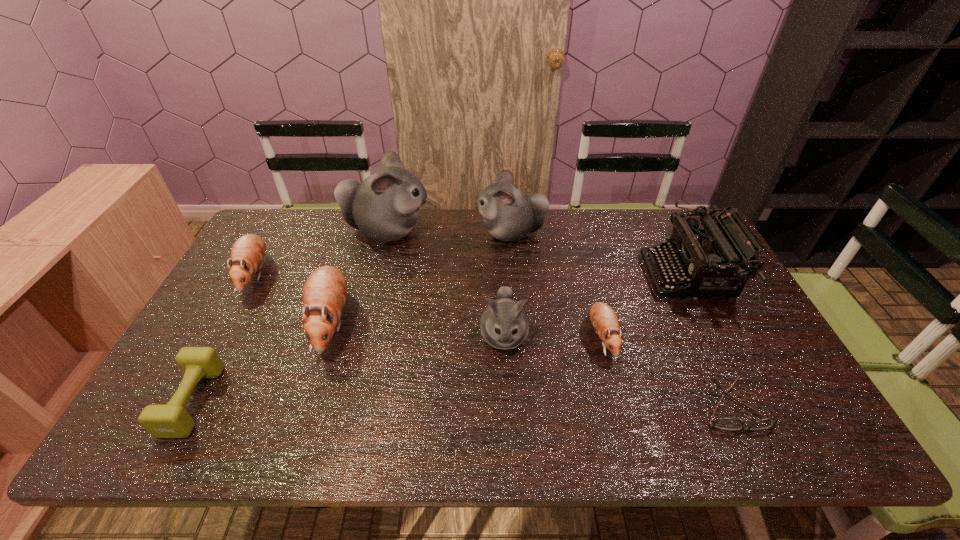
At what (x,y) coordinates should I click in order to perform the action: click on the leftmost white hamster. Please return your answer as a coordinate pair (x, y). This screenshot has height=540, width=960. Looking at the image, I should click on (385, 206).

You are a GUI agent. You are given a task and a screenshot of the screen. Output one action in this format:
    pyautogui.click(x=<x>, y=<y>)
    Task: Click on the biggest white hamster
    
    Given the screenshot: What is the action you would take?
    pyautogui.click(x=385, y=206)

At what (x,y) coordinates should I click in order to perform the action: click on the second biggest white hamster. Please return your answer as a coordinate pair (x, y). This screenshot has height=540, width=960. Looking at the image, I should click on (509, 214).

Identify the location of typewriter. The image size is (960, 540). (695, 255).

This screenshot has height=540, width=960. In order to click on the nearest white hamster in this screenshot , I will do `click(504, 324)`.

I want to click on the second brown hamster from right to left, so click(x=324, y=294).

In order to click on the fifth tallest hamster in this screenshot , I will do `click(247, 254)`.

The height and width of the screenshot is (540, 960). What are the coordinates of `the leftmost brown hamster` in the screenshot? It's located at point(247,254).

Where is `the shortest hamster`? Image resolution: width=960 pixels, height=540 pixels. the shortest hamster is located at coordinates (604, 319).

This screenshot has height=540, width=960. I want to click on the seventh object from left to right, so click(x=604, y=319).